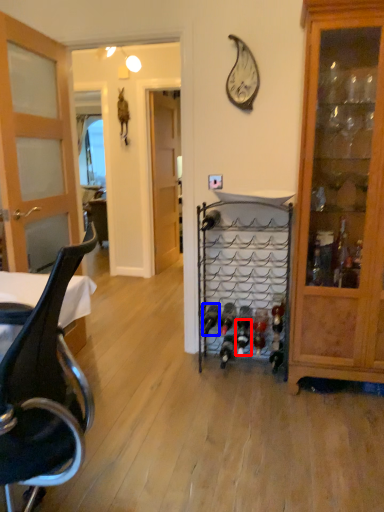
Question: Which point is further to the camera, wine bottle (highlighted by a red box) or wine bottle (highlighted by a blue box)?

Choices:
 (A) wine bottle
 (B) wine bottle

Answer: (B)